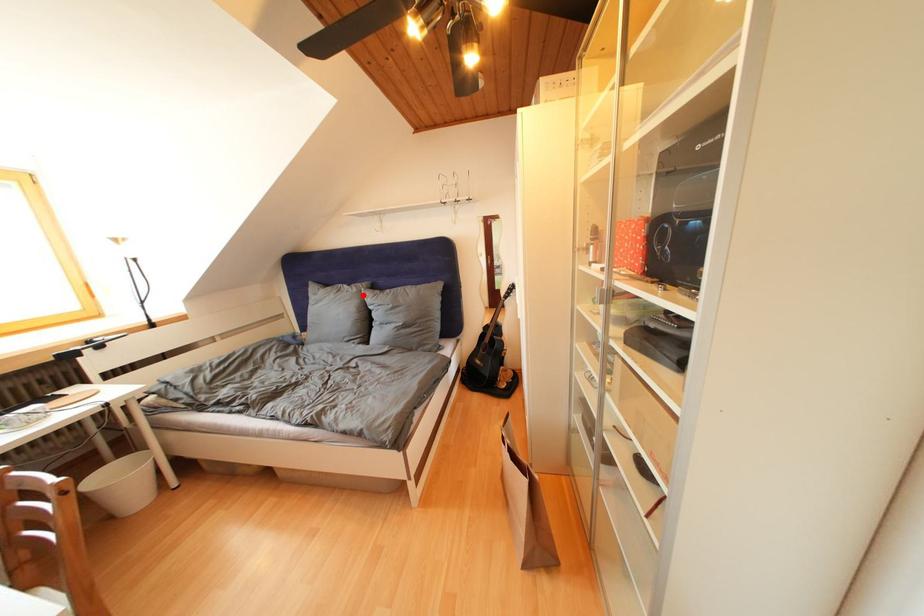
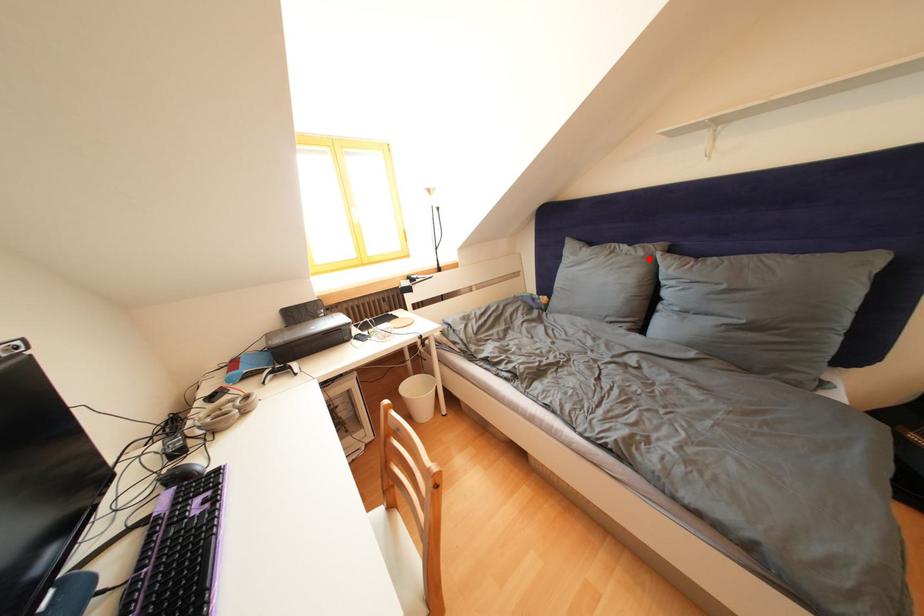
I am providing you with two images of the same scene from different viewpoints. A red point is marked on the first image and another point is marked on the second image. Do the highlighted points in image1 and image2 indicate the same real-world spot?

Yes